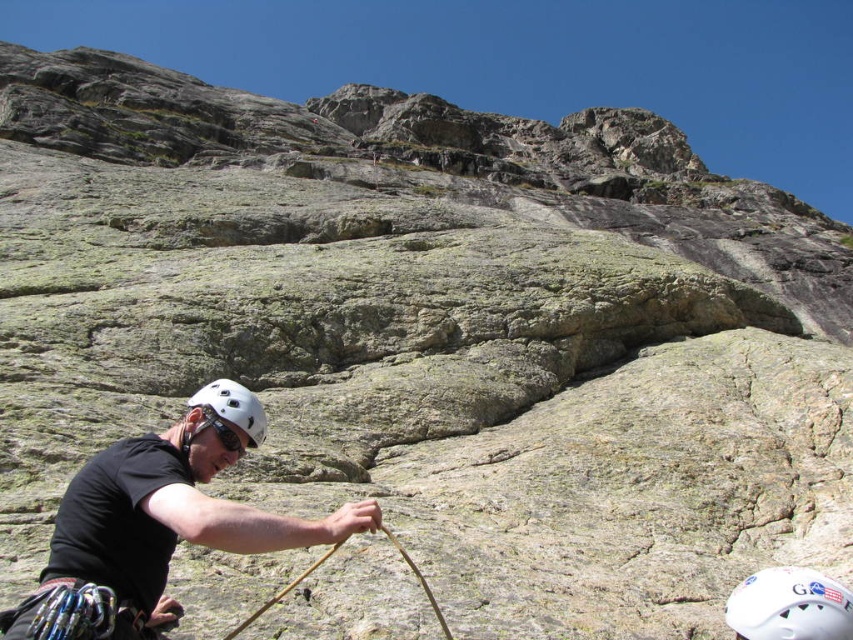
You are a safety inspector assessing the climbing setup. You notice two helmets, the black matte helmet at lower left and the white matte helmet at lower left. Considering the minimum safe distance of 3 meters between climbers for safety protocols, is the current spacing between them compliant?

The distance between the black matte helmet at lower left and the white matte helmet at lower left is 3.62 meters, which exceeds the minimum safe distance of 3 meters. Therefore, the current spacing is compliant with safety protocols.

You are a rock climbing instructor observing the climber. You notice the black matte helmet at lower left. Where exactly is this helmet positioned relative to the climber?

The black matte helmet at lower left is positioned at coordinates point (167, 513), which places it near the lower left area of the climber.